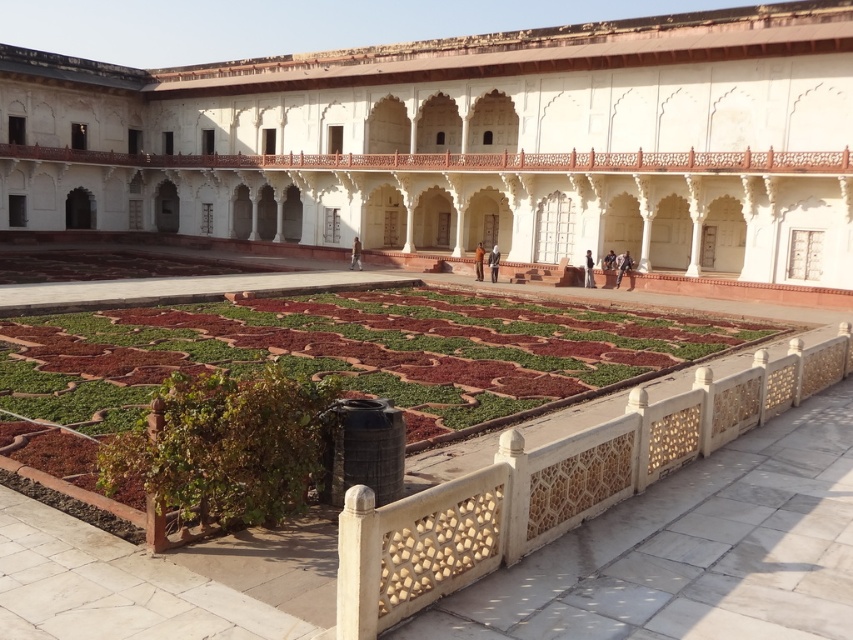
You are an architect visiting the historical site and want to place a small decorative statue in the garden. The statue is 1 meter tall. Considering the scale of the white stone palace at center and the light brown fabric at center, which object would be more appropriate to place the statue near to maintain visual harmony?

The light brown fabric at center would be more appropriate to place the statue near since it is smaller in size compared to the white stone palace at center, ensuring the statue doesn t overwhelm the area.

You are an architect analyzing the symmetry of the building and its surroundings. You notice the green textured garden at center and the orange fabric at center. Which object is positioned higher in the scene?

The green textured garden at center is taller than the orange fabric at center, so it is positioned higher in the scene.